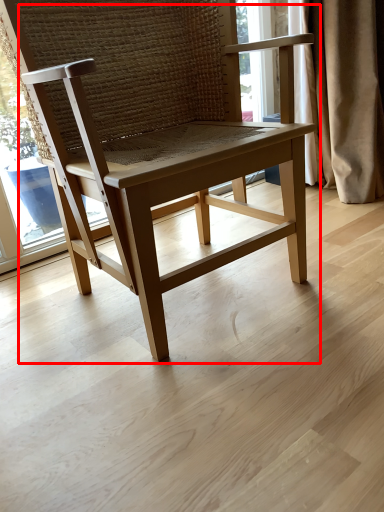
Question: From the image's perspective, where is chair (annotated by the red box) located relative to curtain?

Choices:
 (A) below
 (B) above

Answer: (A)